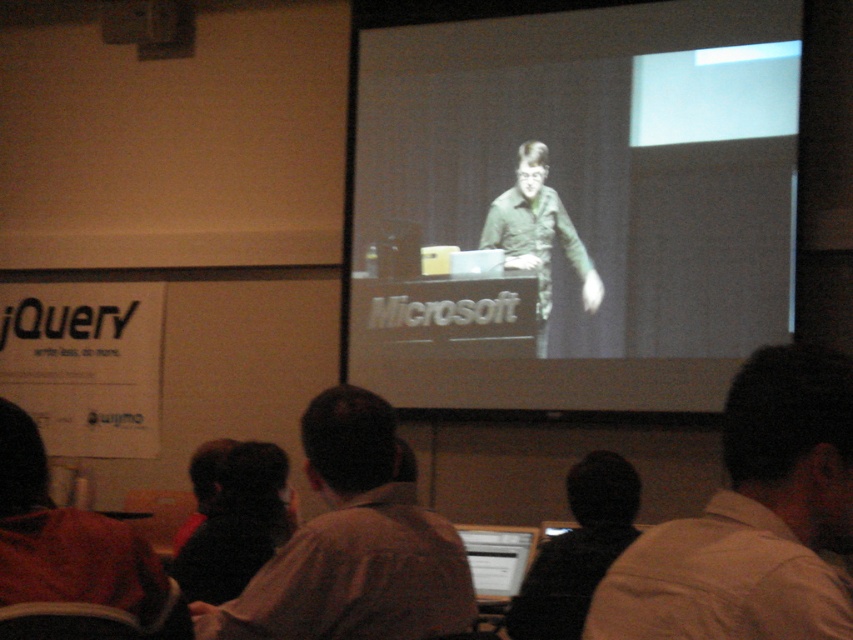
Question: Which of the following is the farthest from the observer?

Choices:
 (A) dark brown leather jacket at lower left
 (B) white matte projection screen at upper center
 (C) black fuzzy hat at lower center
 (D) green matte shirt at center

Answer: (D)

Question: Can you confirm if light brown shirt at lower right is positioned below matte plastic laptop at lower center?

Choices:
 (A) no
 (B) yes

Answer: (A)

Question: Which object is closer to the camera taking this photo?

Choices:
 (A) dark brown leather jacket at lower left
 (B) matte plastic laptop at lower center

Answer: (A)

Question: Estimate the real-world distances between objects in this image. Which object is farther from the white matte projection screen at upper center?

Choices:
 (A) dark brown leather jacket at lower left
 (B) black fuzzy hat at lower center

Answer: (A)

Question: Is light brown shirt at lower right wider than dark brown leather jacket at lower left?

Choices:
 (A) no
 (B) yes

Answer: (B)

Question: Is light brown shirt at lower right behind matte plastic laptop at lower center?

Choices:
 (A) yes
 (B) no

Answer: (B)